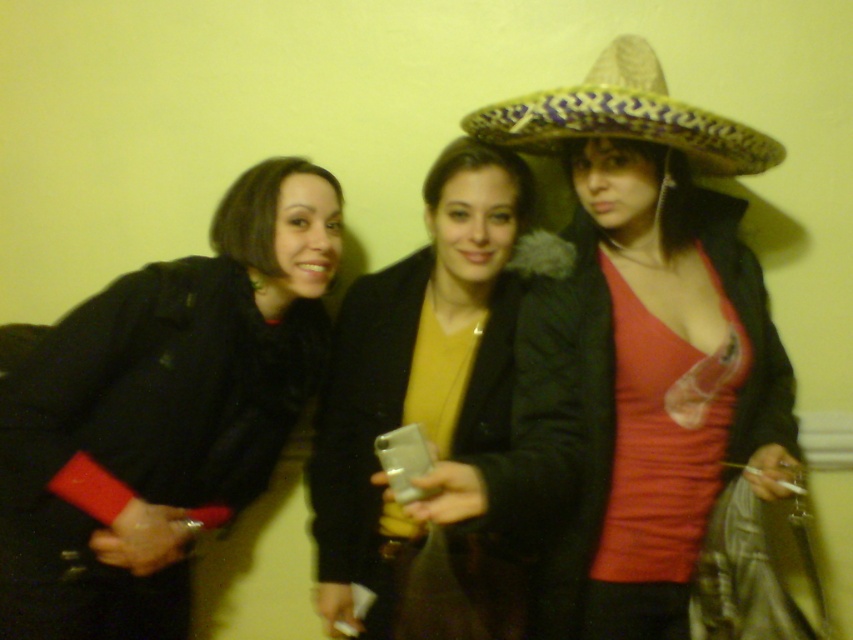
Question: Is black fuzzy coat at left wider than multicolored woven sombrero at center?

Choices:
 (A) yes
 (B) no

Answer: (B)

Question: Where is black fuzzy coat at left located in relation to multicolored woven sombrero at center in the image?

Choices:
 (A) below
 (B) above

Answer: (A)

Question: From the image, what is the correct spatial relationship of black fuzzy coat at left in relation to multicolored woven sombrero at center?

Choices:
 (A) left
 (B) right

Answer: (A)

Question: Which of the following is the closest to the observer?

Choices:
 (A) black fuzzy coat at left
 (B) multicolored woven sombrero at center

Answer: (B)